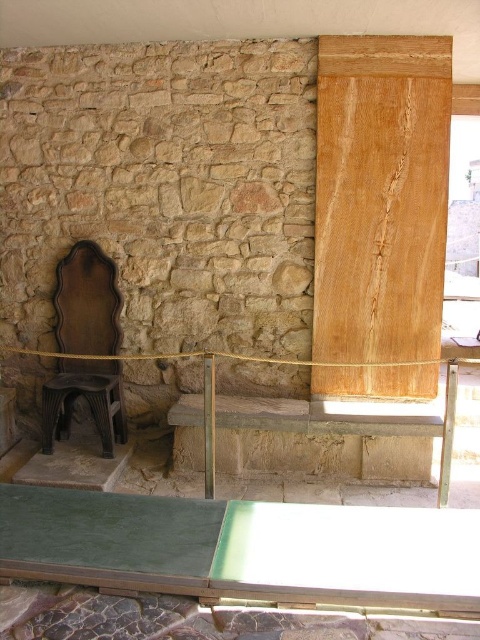
You are a guest in this room and want to sit down. You see the dark brown wood chair at left and the black plastic stool at lower left. Which one is taller and more suitable for someone who prefers a higher seat?

The dark brown wood chair at left is taller than the black plastic stool at lower left, so it is more suitable for someone who prefers a higher seat.

You are an interior designer planning to move a sofa into this room. The sofa is 2 meters wide. You need to place it between the dark brown wood chair at left and the black plastic stool at lower left. Is there enough space?

The dark brown wood chair at left is positioned over the black plastic stool at lower left, meaning they are stacked or placed closely together. This likely leaves insufficient space between them to fit a 2 meter wide sofa. The sofa would not fit in this arrangement.

You are a visitor standing in the room and want to sit down. You see the green glass table at lower center and the dark brown wood chair at left. Which object is closer to you?

The green glass table at lower center is closer to you because it is in front of the dark brown wood chair at left.